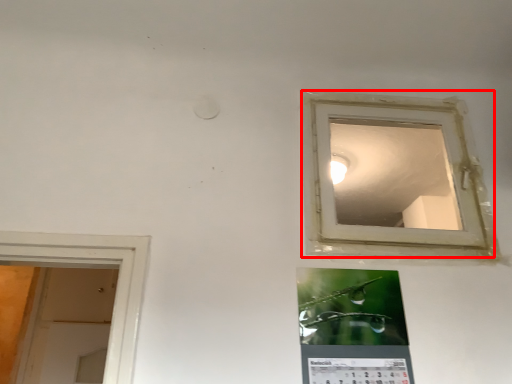
Question: Where is window (annotated by the red box) located in relation to bulletin board in the image?

Choices:
 (A) right
 (B) left

Answer: (A)